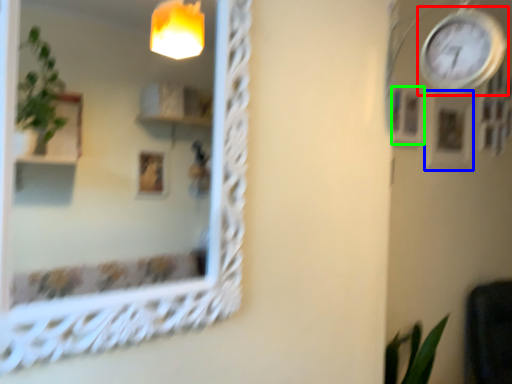
Question: Considering the real-world distances, which object is closest to clock (highlighted by a red box)? picture frame (highlighted by a blue box) or picture frame (highlighted by a green box).

Choices:
 (A) picture frame
 (B) picture frame

Answer: (B)